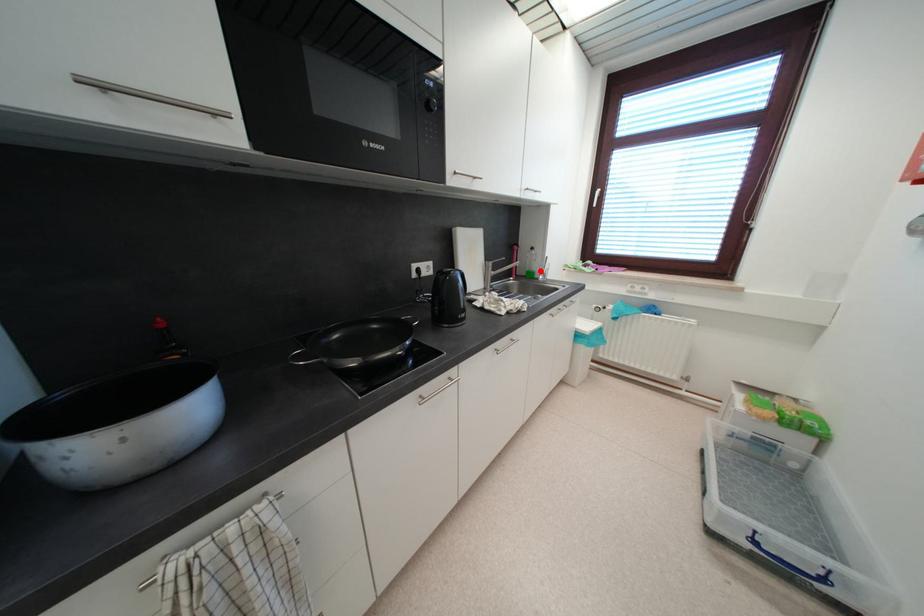
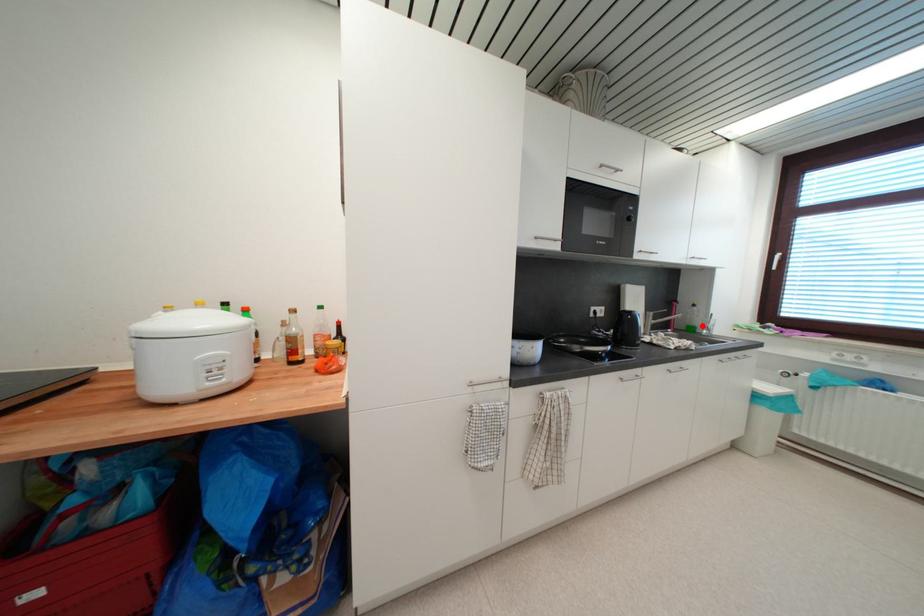
I am providing you with two images of the same scene from different viewpoints. A red point is marked on the first image and another point is marked on the second image. Does the point marked in image1 correspond to the same location as the one in image2?

Yes